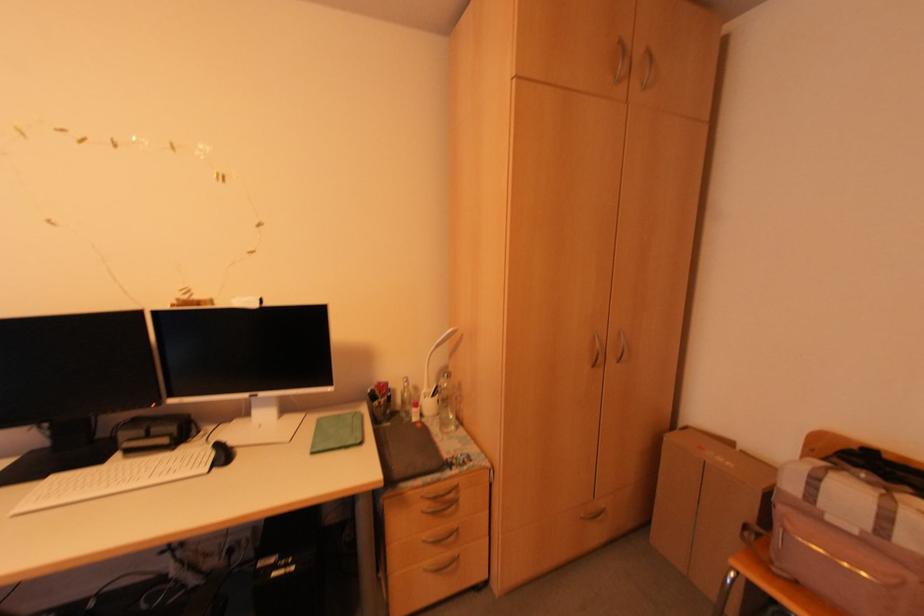
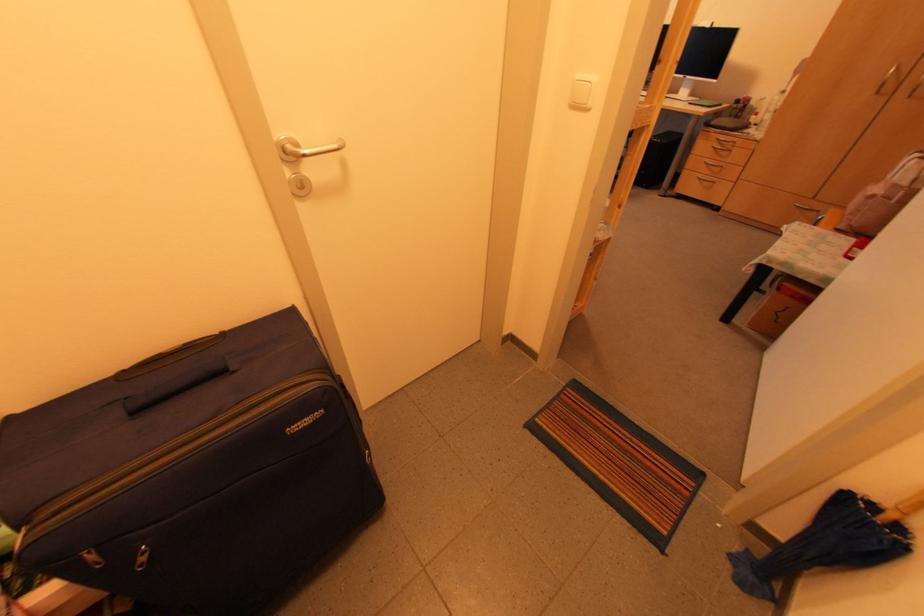
The point at (x=453, y=482) is marked in the first image. Where is the corresponding point in the second image?

(734, 140)